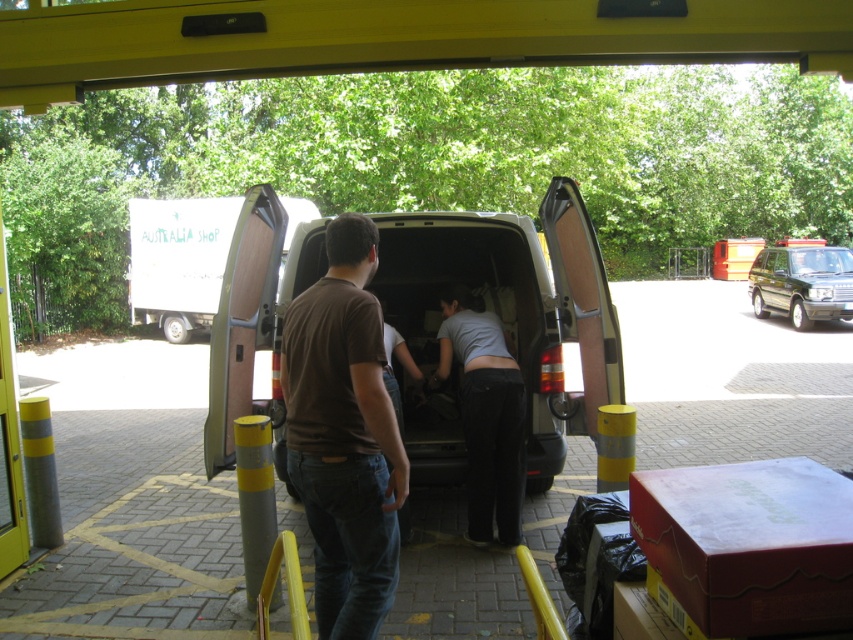
Looking at this image, you are standing in the loading bay and see two points marked in the scene. Which point is closer to you, point (495, 228) or point (849, 296)?

Point (495, 228) is closer to the viewer than point (849, 296).